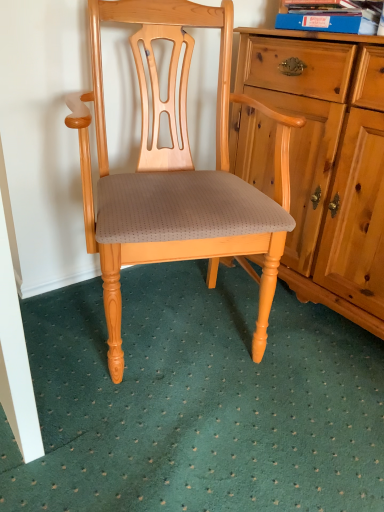
You are a GUI agent. You are given a task and a screenshot of the screen. Output one action in this format:
    pyautogui.click(x=<x>, y=<y>)
    Task: Click on the free space on the front side of matte wood chair at center
    This screenshot has width=384, height=512.
    Given the screenshot: What is the action you would take?
    pyautogui.click(x=181, y=453)